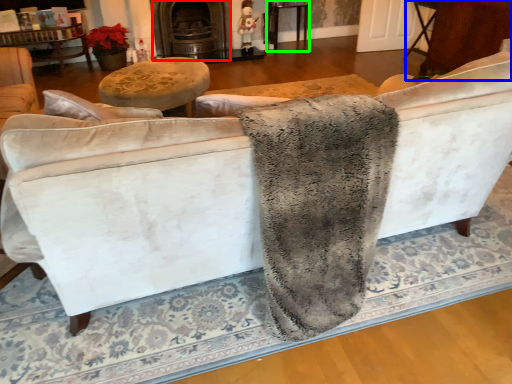
Question: Estimate the real-world distances between objects in this image. Which object is farther from fireplace (highlighted by a red box), table (highlighted by a blue box) or table (highlighted by a green box)?

Choices:
 (A) table
 (B) table

Answer: (A)